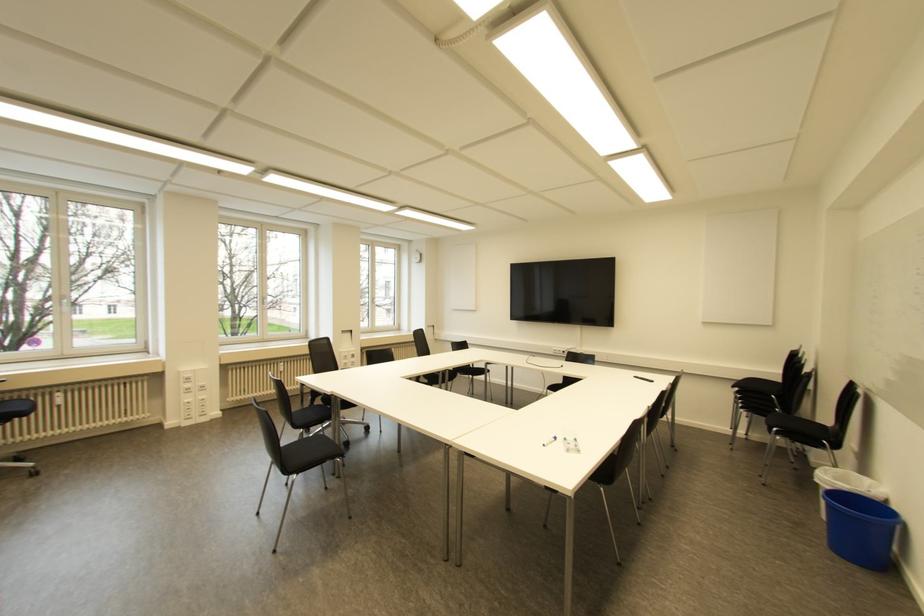
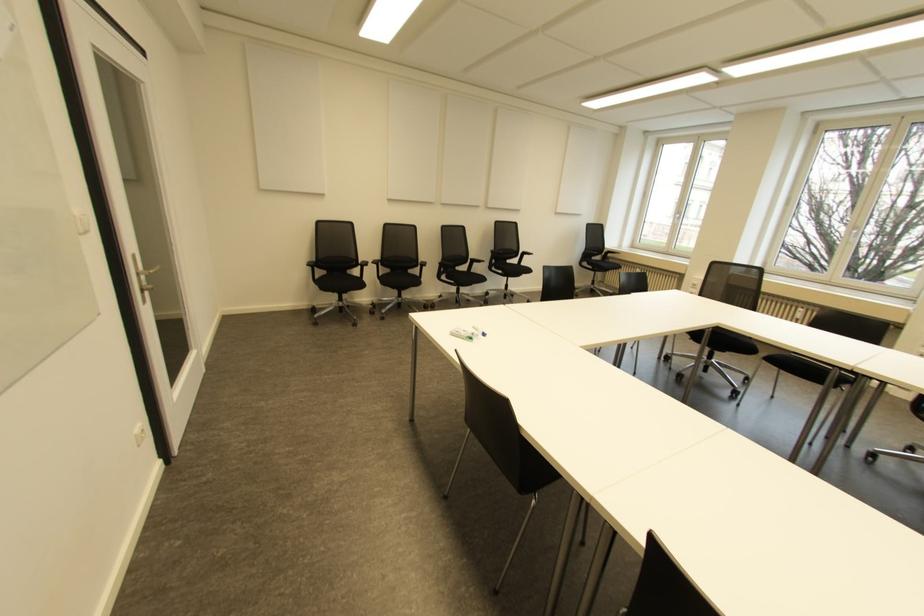
Question: I am providing you with two images of the same scene from different viewpoints. After the viewpoint changes to image2, which objects are now occluded?

Choices:
 (A) metal door handle
 (B) small plastic box
 (C) turntable dust cover
 (D) black chair sitting surface

Answer: (D)